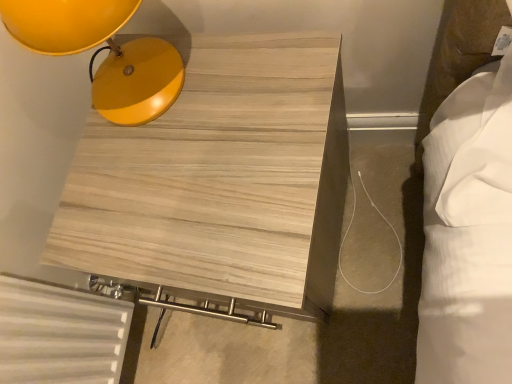
Locate an element on the screen. The height and width of the screenshot is (384, 512). matte yellow lampshade at upper left is located at coordinates (103, 48).

What do you see at coordinates (103, 48) in the screenshot? This screenshot has width=512, height=384. I see `matte yellow lampshade at upper left` at bounding box center [103, 48].

What do you see at coordinates (220, 181) in the screenshot?
I see `light wood/texture side table at upper left` at bounding box center [220, 181].

This screenshot has height=384, width=512. What are the coordinates of `light wood/texture side table at upper left` in the screenshot? It's located at (220, 181).

You are a GUI agent. You are given a task and a screenshot of the screen. Output one action in this format:
    pyautogui.click(x=<x>, y=<y>)
    Task: Click on the matte yellow lampshade at upper left
    This screenshot has height=384, width=512.
    Given the screenshot: What is the action you would take?
    pyautogui.click(x=103, y=48)

Is matte yellow lampshade at upper left to the right of light wood/texture side table at upper left from the viewer's perspective?

No, matte yellow lampshade at upper left is not to the right of light wood/texture side table at upper left.

Which is behind, matte yellow lampshade at upper left or light wood/texture side table at upper left?

Positioned behind is light wood/texture side table at upper left.

Which is in front, point (42, 17) or point (300, 211)?

The point (42, 17) is closer to the camera.

From the image's perspective, would you say matte yellow lampshade at upper left is positioned over light wood/texture side table at upper left?

Yes.

From a real-world perspective, between matte yellow lampshade at upper left and light wood/texture side table at upper left, who is vertically lower?

light wood/texture side table at upper left.

Considering the sizes of objects matte yellow lampshade at upper left and light wood/texture side table at upper left in the image provided, who is wider, matte yellow lampshade at upper left or light wood/texture side table at upper left?

With larger width is light wood/texture side table at upper left.

Which of these two, matte yellow lampshade at upper left or light wood/texture side table at upper left, stands shorter?

matte yellow lampshade at upper left.

Considering the sizes of objects matte yellow lampshade at upper left and light wood/texture side table at upper left in the image provided, who is smaller, matte yellow lampshade at upper left or light wood/texture side table at upper left?

Smaller between the two is matte yellow lampshade at upper left.

Is light wood/texture side table at upper left inside matte yellow lampshade at upper left?

No.

Is the surface of matte yellow lampshade at upper left in direct contact with light wood/texture side table at upper left?

No, matte yellow lampshade at upper left is not with light wood/texture side table at upper left.

Could you tell me if matte yellow lampshade at upper left is turned towards light wood/texture side table at upper left?

No, matte yellow lampshade at upper left is not oriented towards light wood/texture side table at upper left.

How different are the orientations of matte yellow lampshade at upper left and light wood/texture side table at upper left in degrees?

There is a 1-degree angle between the facing directions of matte yellow lampshade at upper left and light wood/texture side table at upper left.

Where is `lamp that is above the light wood/texture side table at upper left (from the image's perspective)`? The width and height of the screenshot is (512, 384). lamp that is above the light wood/texture side table at upper left (from the image's perspective) is located at coordinates (103, 48).

Considering the relative positions of light wood/texture side table at upper left and matte yellow lampshade at upper left in the image provided, is light wood/texture side table at upper left to the left of matte yellow lampshade at upper left from the viewer's perspective?

In fact, light wood/texture side table at upper left is to the right of matte yellow lampshade at upper left.

Considering the positions of objects light wood/texture side table at upper left and matte yellow lampshade at upper left in the image provided, who is behind, light wood/texture side table at upper left or matte yellow lampshade at upper left?

light wood/texture side table at upper left is more distant.

Does point (277, 148) lie behind point (174, 57)?

That is False.

Consider the image. From the image's perspective, does light wood/texture side table at upper left appear lower than matte yellow lampshade at upper left?

Yes.

From a real-world perspective, is light wood/texture side table at upper left physically below matte yellow lampshade at upper left?

Yes, from a real-world perspective, light wood/texture side table at upper left is under matte yellow lampshade at upper left.

In terms of width, does light wood/texture side table at upper left look wider or thinner when compared to matte yellow lampshade at upper left?

light wood/texture side table at upper left is wider than matte yellow lampshade at upper left.

Who is taller, light wood/texture side table at upper left or matte yellow lampshade at upper left?

Standing taller between the two is light wood/texture side table at upper left.

Considering the sizes of light wood/texture side table at upper left and matte yellow lampshade at upper left in the image, is light wood/texture side table at upper left bigger or smaller than matte yellow lampshade at upper left?

Considering their sizes, light wood/texture side table at upper left takes up more space than matte yellow lampshade at upper left.

Is matte yellow lampshade at upper left a part of light wood/texture side table at upper left?

No, matte yellow lampshade at upper left is not surrounded by light wood/texture side table at upper left.

Is light wood/texture side table at upper left not near matte yellow lampshade at upper left?

No, there isn't a large distance between light wood/texture side table at upper left and matte yellow lampshade at upper left.

Is light wood/texture side table at upper left facing away from matte yellow lampshade at upper left?

No, light wood/texture side table at upper left's orientation is not away from matte yellow lampshade at upper left.

What's the angular difference between light wood/texture side table at upper left and matte yellow lampshade at upper left's facing directions?

1 degrees separate the facing orientations of light wood/texture side table at upper left and matte yellow lampshade at upper left.

Identify the location of furniture below the matte yellow lampshade at upper left (from a real-world perspective). (220, 181).

The image size is (512, 384). In order to click on furniture beneath the matte yellow lampshade at upper left (from a real-world perspective) in this screenshot , I will do `click(220, 181)`.

Identify the location of lamp that is above the light wood/texture side table at upper left (from the image's perspective). (103, 48).